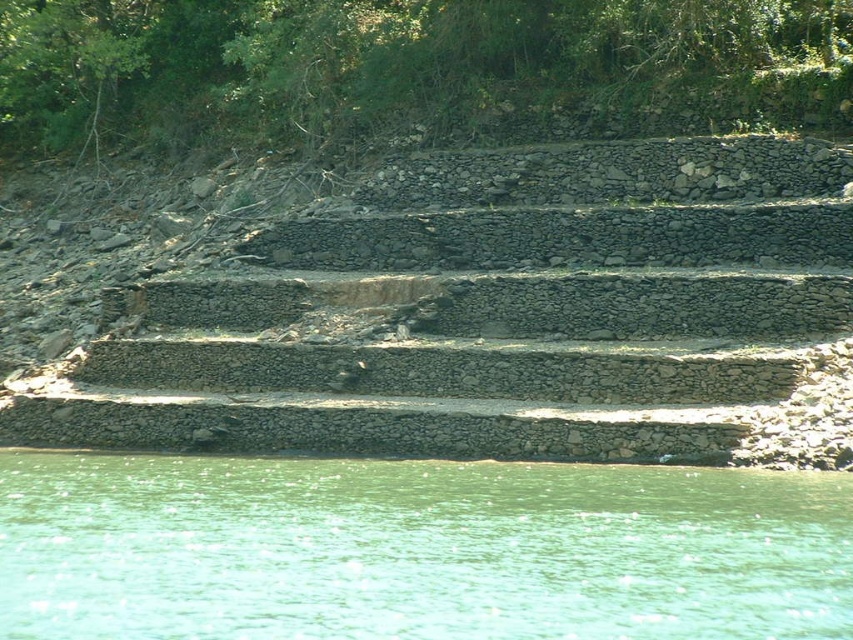
Is gray stone stairs at center positioned at the back of green water at lower center?

Yes, it is.

Does point (28, 436) come closer to viewer compared to point (664, 548)?

No, it is behind (664, 548).

Which is behind, point (657, 403) or point (105, 560)?

Positioned behind is point (657, 403).

Locate an element on the screen. gray stone stairs at center is located at coordinates (492, 312).